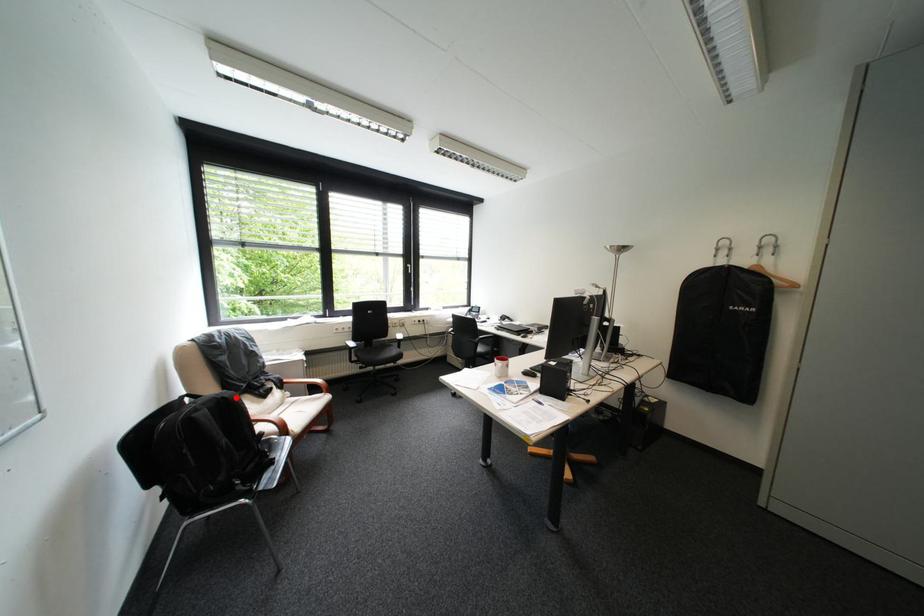
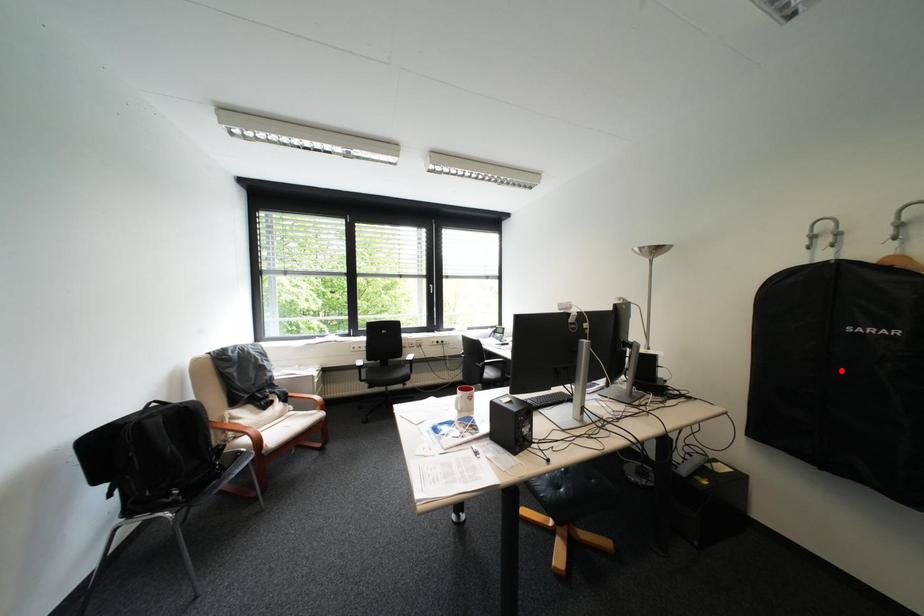
I am providing you with two images of the same scene from different viewpoints. A red point is marked on the first image and another point is marked on the second image. Are the points marked in image1 and image2 representing the same 3D position?

No